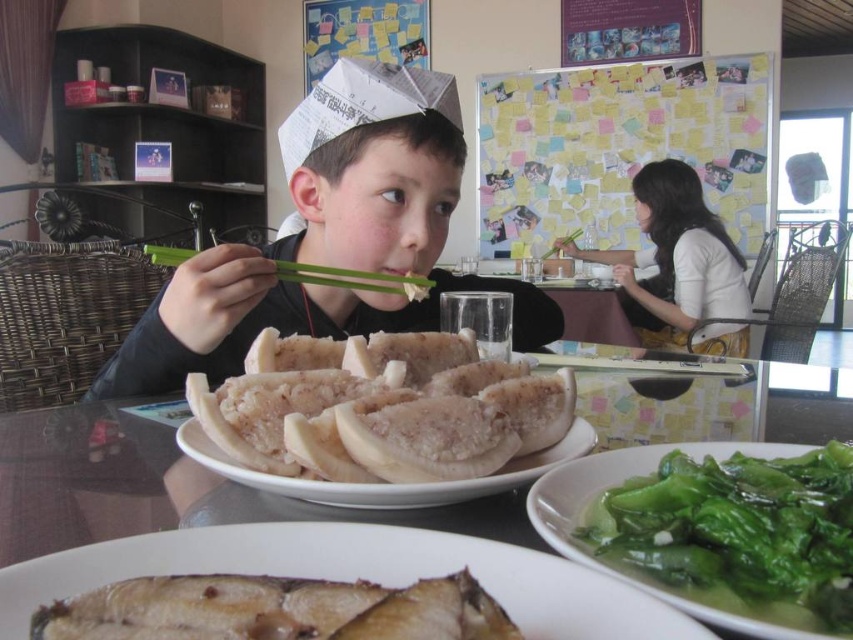
Does white soft rice cake at center appear on the left side of brown matte fish at lower left?

No, white soft rice cake at center is not to the left of brown matte fish at lower left.

Measure the distance between white soft rice cake at center and brown matte fish at lower left.

They are 6.86 inches apart.

Is point (193, 397) farther from viewer compared to point (428, 620)?

Yes.

Where is `white soft rice cake at center`? white soft rice cake at center is located at coordinates (387, 413).

Between matte white paper hat at center and yellow sticky notes at upper center, which one is positioned higher?

yellow sticky notes at upper center

In the scene shown: Which of these two, matte white paper hat at center or yellow sticky notes at upper center, stands taller?

yellow sticky notes at upper center

Is point (323, 304) more distant than point (711, 148)?

No, it is in front of (711, 148).

Find the location of a particular element. This screenshot has width=853, height=640. matte white paper hat at center is located at coordinates (329, 237).

Is point (840, 620) farther from camera compared to point (140, 566)?

No, (840, 620) is closer to viewer.

Is green leafy vegetable at lower right shorter than brown glazed fish at lower left?

In fact, green leafy vegetable at lower right may be taller than brown glazed fish at lower left.

Is point (834, 496) closer to camera compared to point (386, 541)?

No, it is not.

Where is `green leafy vegetable at lower right`? This screenshot has width=853, height=640. green leafy vegetable at lower right is located at coordinates (738, 532).